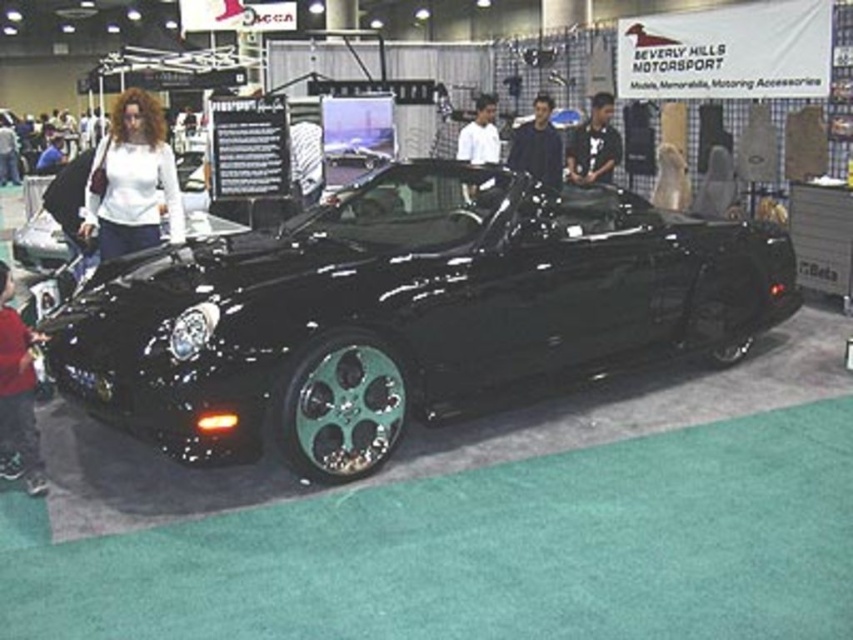
Question: Does glossy black car at center appear under white fabric shirt at upper left?

Choices:
 (A) no
 (B) yes

Answer: (B)

Question: Can you confirm if glossy black car at center is positioned below matte black jacket at lower left?

Choices:
 (A) yes
 (B) no

Answer: (B)

Question: Which is nearer to the glossy black car at center?

Choices:
 (A) black leather jacket at upper center
 (B) white fabric shirt at upper left
 (C) matte black jacket at lower left
 (D) white matte shirt at center

Answer: (B)

Question: Is glossy black car at center smaller than matte black jacket at lower left?

Choices:
 (A) no
 (B) yes

Answer: (A)

Question: Which of the following is the farthest from the observer?

Choices:
 (A) black leather jacket at upper center
 (B) matte black jacket at lower left
 (C) white matte shirt at center

Answer: (C)

Question: Which object is positioned farthest from the glossy black car at center?

Choices:
 (A) white matte shirt at center
 (B) white fabric shirt at upper left

Answer: (A)